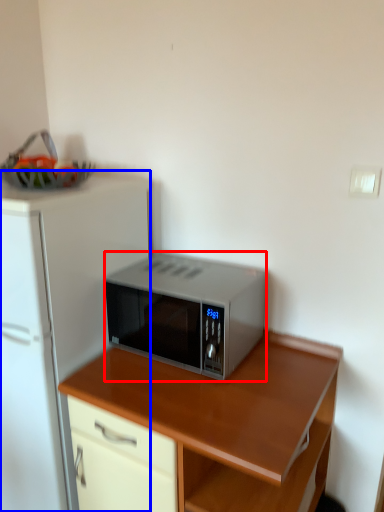
Question: Among these objects, which one is nearest to the camera, microwave oven (highlighted by a red box) or refrigerator (highlighted by a blue box)?

Choices:
 (A) microwave oven
 (B) refrigerator

Answer: (B)